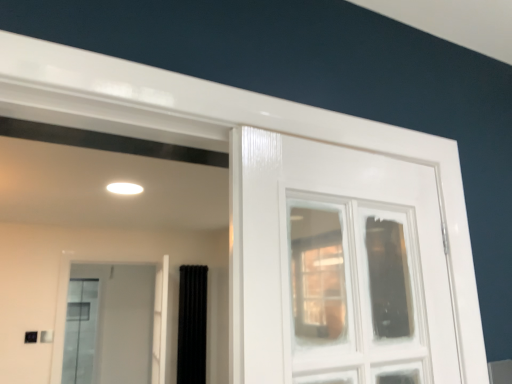
Question: Looking at the image, does clear glass window at center seem bigger or smaller compared to clear glass screen door at upper left?

Choices:
 (A) big
 (B) small

Answer: (B)

Question: From the image's perspective, is clear glass window at center located above or below clear glass screen door at upper left?

Choices:
 (A) below
 (B) above

Answer: (B)

Question: Which object is positioned closest to the clear glass window at center?

Choices:
 (A) clear glass screen door at upper left
 (B) black velvet curtain at center

Answer: (B)

Question: Estimate the real-world distances between objects in this image. Which object is closer to the clear glass window at center?

Choices:
 (A) clear glass screen door at upper left
 (B) black velvet curtain at center

Answer: (B)